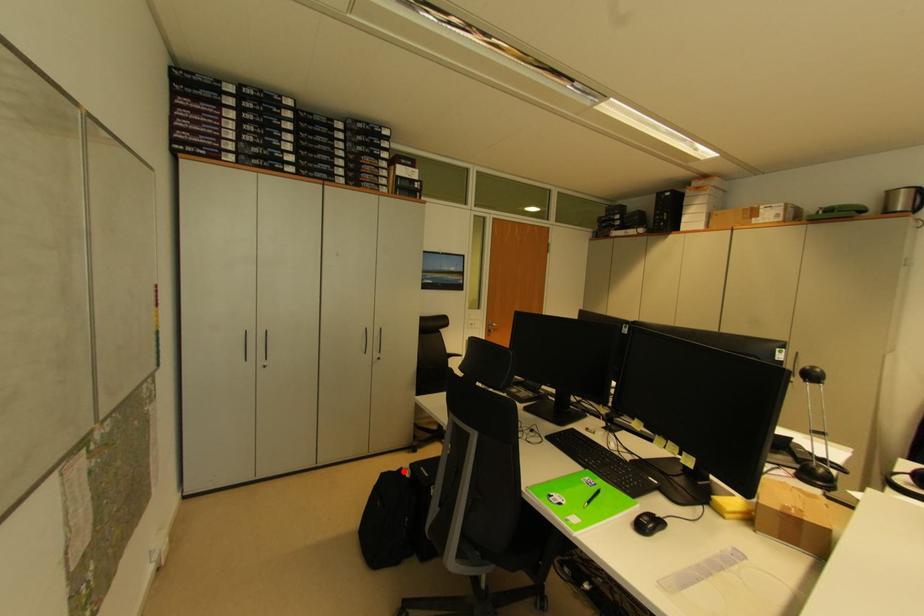
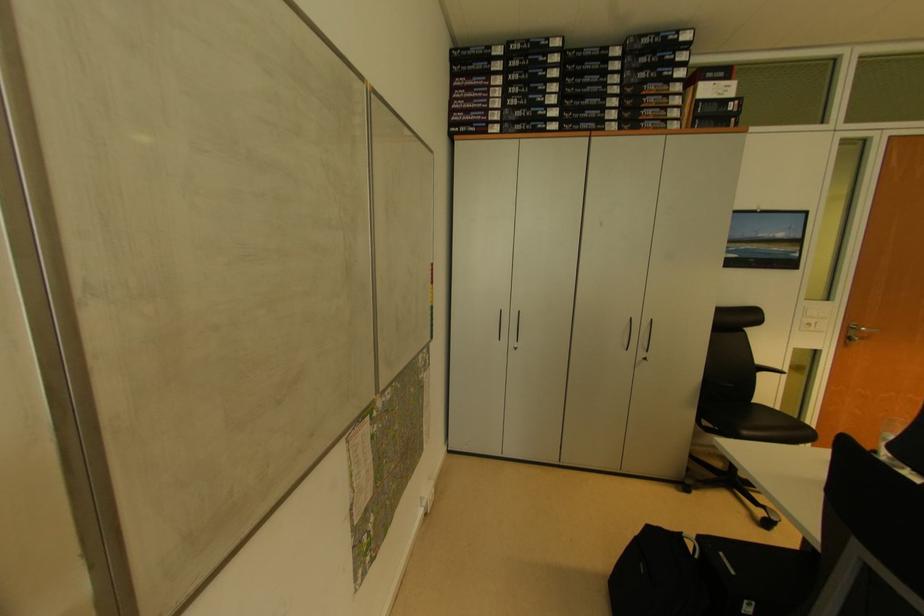
Question: I am providing you with two images of the same scene from different viewpoints. In image1, a red point is highlighted. Considering the same 3D point in image2, which of the following is correct?

Choices:
 (A) It is closer
 (B) It is farther

Answer: (B)